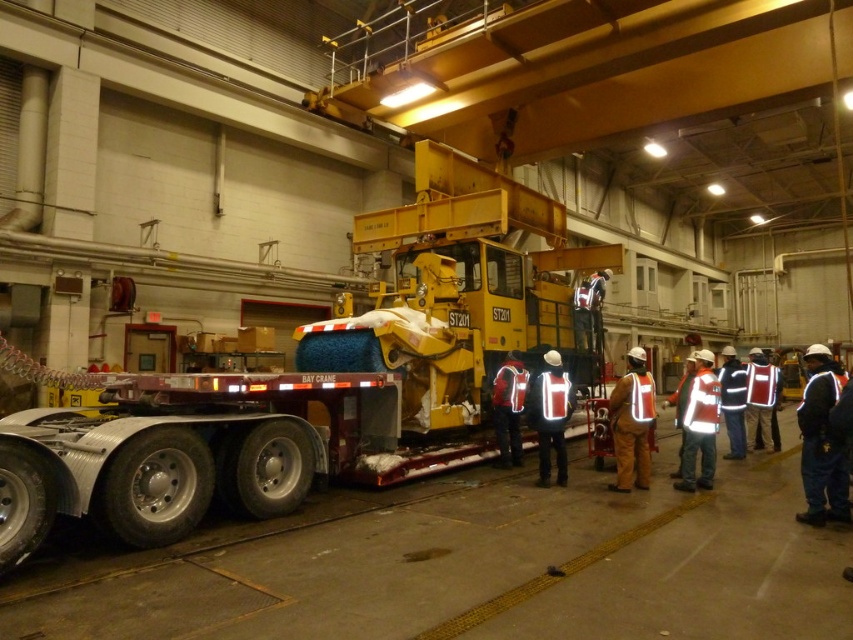
Is reflective orange safety vest at center to the left of reflective fabric vest at center from the viewer's perspective?

No, reflective orange safety vest at center is not to the left of reflective fabric vest at center.

I want to click on reflective orange safety vest at center, so click(x=631, y=422).

Is metallic trailer truck at center smaller than reflective fabric safety vest at right?

No, metallic trailer truck at center is not smaller than reflective fabric safety vest at right.

Between metallic trailer truck at center and reflective fabric safety vest at right, which one is positioned lower?

reflective fabric safety vest at right

I want to click on metallic trailer truck at center, so click(317, 376).

Identify the location of metallic trailer truck at center. (317, 376).

Who is lower down, metallic trailer truck at center or reflective fabric safety vest at center?

reflective fabric safety vest at center

Does point (254, 387) lie behind point (721, 378)?

No, it is not.

Identify the location of metallic trailer truck at center. (317, 376).